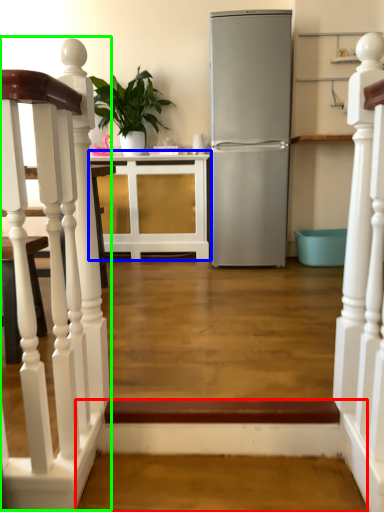
Question: Which object is the closest to the stairwell (highlighted by a red box)? Choose among these: cabinetry (highlighted by a blue box) or stairwell (highlighted by a green box).

Choices:
 (A) cabinetry
 (B) stairwell

Answer: (B)